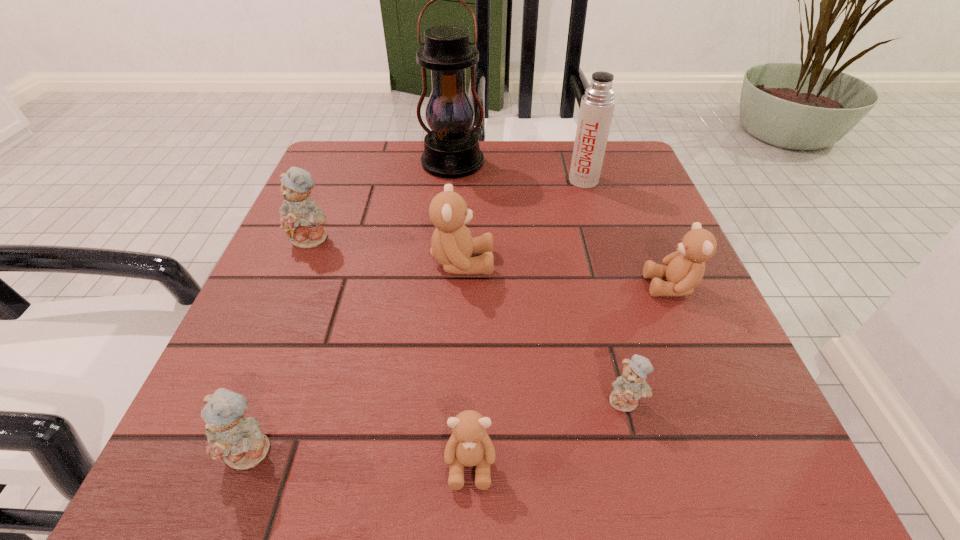
Select which teddy bear appears as the fifth closest to the smallest brown teddy bear. Please provide its 2D coordinates. Your answer should be formatted as a tuple, i.e. [(x, y)], where the tuple contains the x and y coordinates of a point satisfying the conditions above.

[(301, 219)]

The image size is (960, 540). What are the coordinates of `brown teddy bear that is the nearest to the sixth farthest object` in the screenshot? It's located at (469, 445).

Image resolution: width=960 pixels, height=540 pixels. What are the coordinates of `the third closest brown teddy bear to the second farthest blue teddy bear` in the screenshot? It's located at (452, 245).

Locate which blue teddy bear ranks second in proximity to the smallest brown teddy bear. Please provide its 2D coordinates. Your answer should be formatted as a tuple, i.e. [(x, y)], where the tuple contains the x and y coordinates of a point satisfying the conditions above.

[(239, 440)]

The height and width of the screenshot is (540, 960). Find the location of `blue teddy bear that is the closest to the second tallest object`. blue teddy bear that is the closest to the second tallest object is located at coordinates (627, 389).